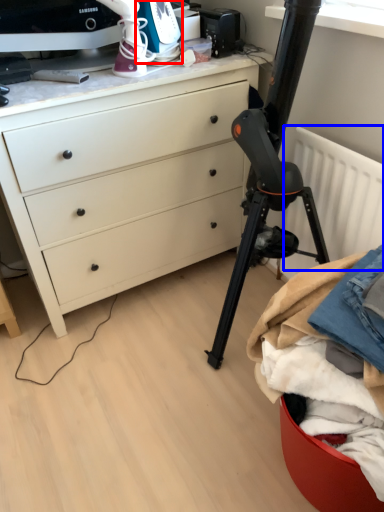
Question: Which point is closer to the camera, appliance (highlighted by a red box) or radiator (highlighted by a blue box)?

Choices:
 (A) appliance
 (B) radiator

Answer: (B)